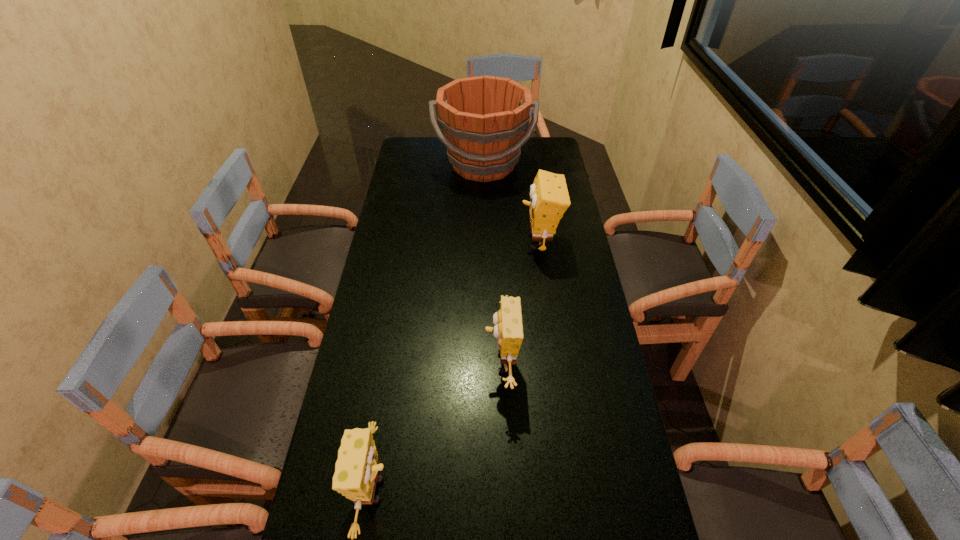
The height and width of the screenshot is (540, 960). Find the location of `the tallest object`. the tallest object is located at coordinates (483, 118).

Find the location of a particular element. The height and width of the screenshot is (540, 960). the farthest object is located at coordinates (483, 118).

Locate an element on the screen. the third shortest object is located at coordinates (549, 195).

This screenshot has height=540, width=960. I want to click on the farthest sponge, so click(549, 195).

Where is `the second sponge from right to left`? This screenshot has width=960, height=540. the second sponge from right to left is located at coordinates (508, 330).

You are a GUI agent. You are given a task and a screenshot of the screen. Output one action in this format:
    pyautogui.click(x=<x>, y=<y>)
    Task: Click on the second nearest sponge
    This screenshot has width=960, height=540.
    Given the screenshot: What is the action you would take?
    pyautogui.click(x=508, y=330)

Locate an element on the screen. The height and width of the screenshot is (540, 960). vacant space situated 0.240m on the handle side of the farthest object is located at coordinates pos(484,228).

The image size is (960, 540). Identify the location of free region located on the face of the tallest sponge. (506, 242).

Identify the location of free spot located on the face of the tallest sponge. (409, 242).

You are a GUI agent. You are given a task and a screenshot of the screen. Output one action in this format:
    pyautogui.click(x=<x>, y=<y>)
    Task: Click on the vacant area situated on the face of the tallest sponge
    This screenshot has height=540, width=960.
    Given the screenshot: What is the action you would take?
    pyautogui.click(x=428, y=242)